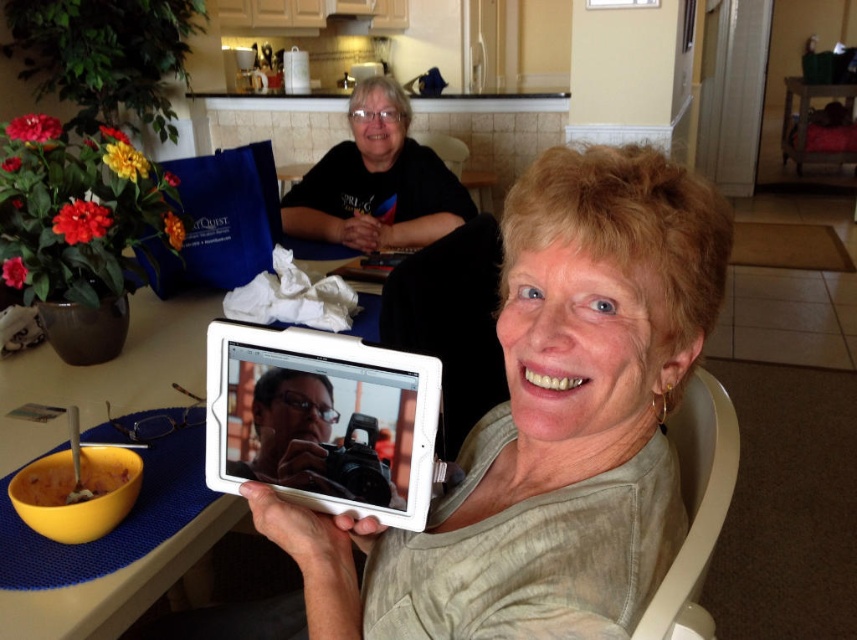
You are standing in the kitchen and want to place a new decorative item on the table. The table has limited space. The point at coordinates (x=549, y=424) marks where the matte white tablet is currently placed. Where should you place the new item to ensure it doesn

The point at coordinates (x=549, y=424) is where the matte white tablet at center is located. To place the new item, choose an area not occupied by existing items like the tablet, blue placemat, yellow bowl, or glasses.

You are a delivery person who needs to place a small package between the black matte shirt at upper center and the yellow plastic bowl at lower left. The package is 12 inches long. Can you fit it in the space between them?

The distance between the black matte shirt at upper center and the yellow plastic bowl at lower left is 27.50 inches, so the 12 inch package can easily fit in the space between them.

You are standing in the kitchen and see two points marked in the image. Which point is closer to you, point (348, 212) or point (267, 282)?

Point (348, 212) is further to the viewer than point (267, 282), so point (267, 282) is closer to you.